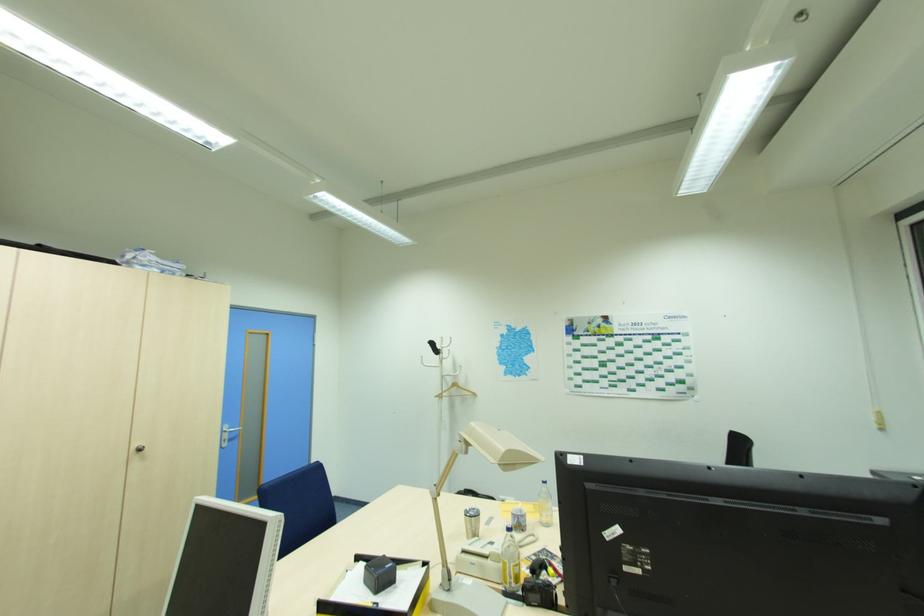
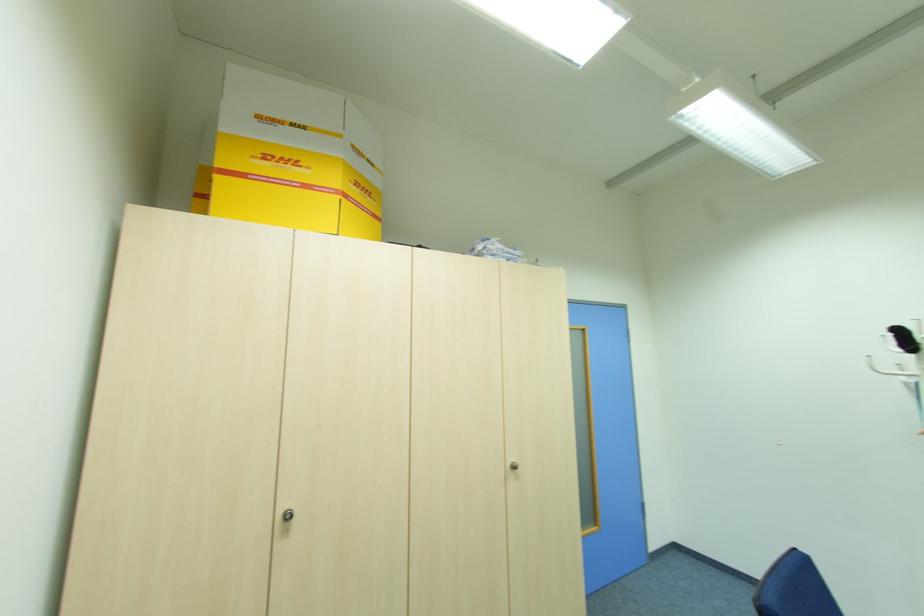
Where in the second image is the point corresponding to pixel 137 446 from the first image?

(513, 460)